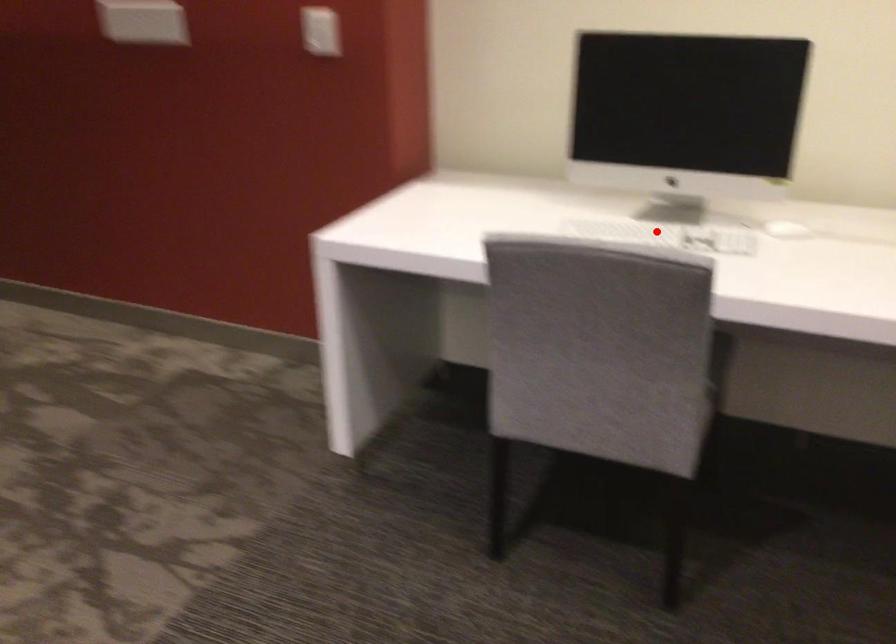
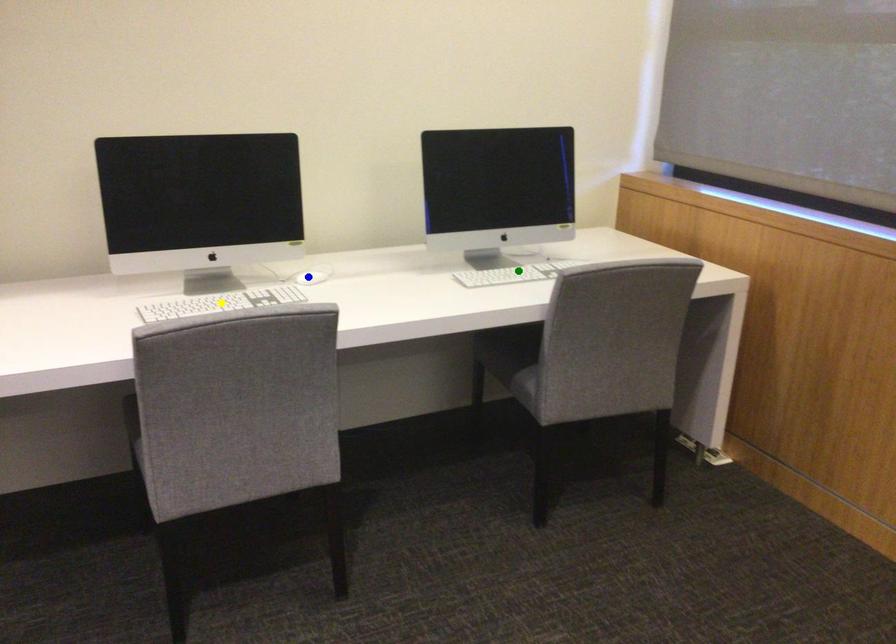
Question: I am providing you with two images of the same scene from different viewpoints. A red point is marked on the first image. You are given multiple points on the second image. In image 2, which mark is for the same physical point as the one in image 1?

Choices:
 (A) yellow point
 (B) blue point
 (C) green point

Answer: (A)